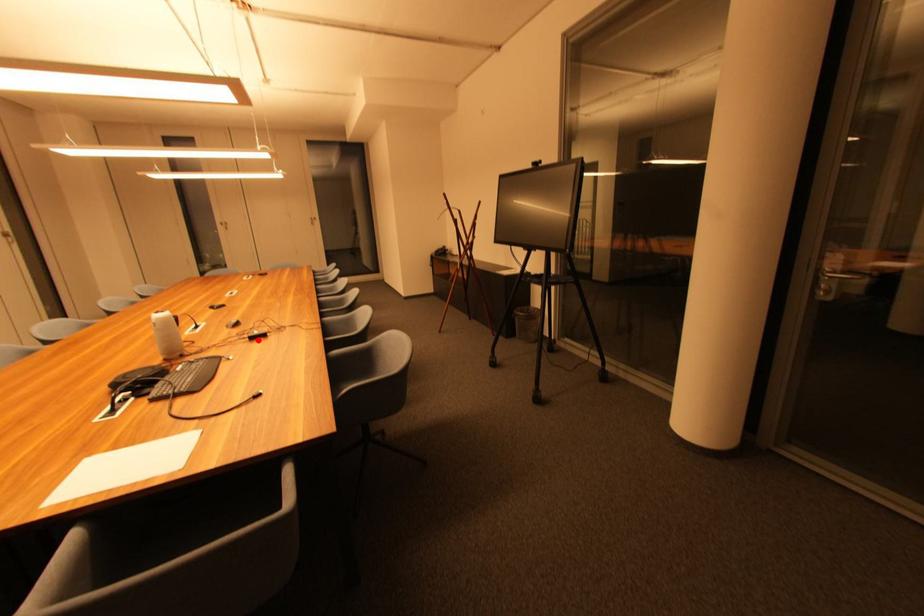
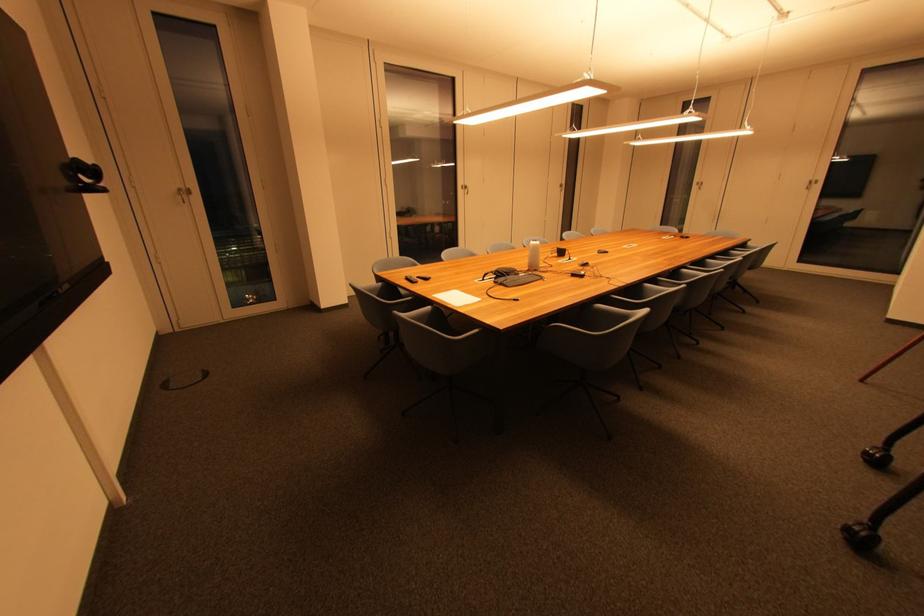
The point at the highlighted location is marked in the first image. Where is the corresponding point in the second image?

(578, 277)